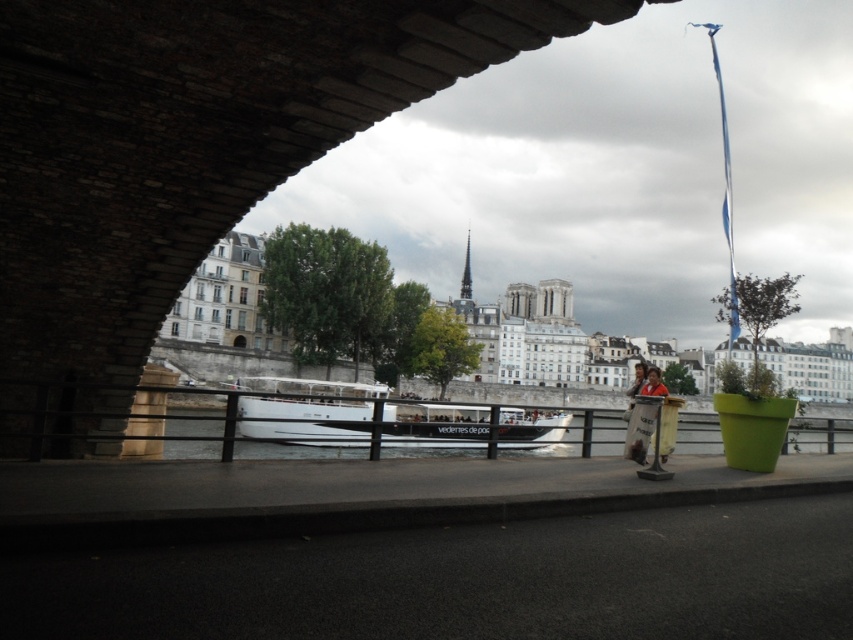
Does gray concrete curb at lower center have a lesser height compared to white glossy boat at center?

Yes, gray concrete curb at lower center is shorter than white glossy boat at center.

Does gray concrete curb at lower center have a lesser width compared to white glossy boat at center?

No.

The height and width of the screenshot is (640, 853). Describe the element at coordinates (358, 515) in the screenshot. I see `gray concrete curb at lower center` at that location.

Image resolution: width=853 pixels, height=640 pixels. In order to click on gray concrete curb at lower center in this screenshot , I will do `click(358, 515)`.

This screenshot has width=853, height=640. What are the coordinates of `dark gray stone bridge at upper left` in the screenshot? It's located at (189, 150).

I want to click on dark gray stone bridge at upper left, so click(x=189, y=150).

Can you confirm if dark gray stone bridge at upper left is smaller than white glossy boat at center?

Incorrect, dark gray stone bridge at upper left is not smaller in size than white glossy boat at center.

I want to click on dark gray stone bridge at upper left, so click(189, 150).

This screenshot has height=640, width=853. Find the location of `dark gray stone bridge at upper left`. dark gray stone bridge at upper left is located at coordinates (189, 150).